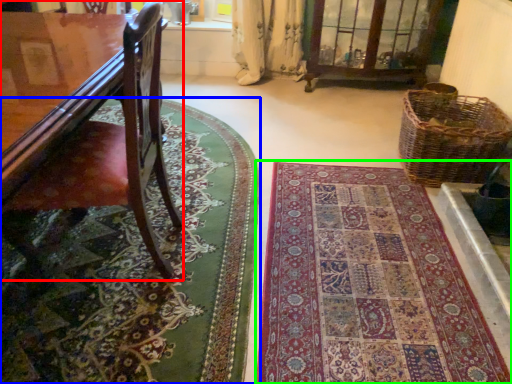
Question: Considering the real-world distances, which object is farthest from furniture (highlighted by a red box)? mat (highlighted by a blue box) or mat (highlighted by a green box)?

Choices:
 (A) mat
 (B) mat

Answer: (B)